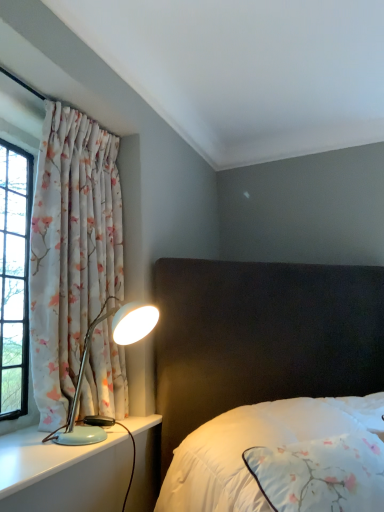
Question: Is white satin bed at center taller or shorter than floral fabric curtain at left?

Choices:
 (A) tall
 (B) short

Answer: (B)

Question: Is white satin bed at center in front of or behind floral fabric curtain at left in the image?

Choices:
 (A) front
 (B) behind

Answer: (A)

Question: Estimate the real-world distances between objects in this image. Which object is closer to the white satin bed at center?

Choices:
 (A) light blue plastic lamp at left
 (B) light blue plastic lamp at left
 (C) floral fabric curtain at left

Answer: (A)

Question: Which of these objects is positioned closest to the floral fabric curtain at left?

Choices:
 (A) light blue plastic lamp at left
 (B) white satin bed at center
 (C) light blue plastic lamp at left

Answer: (C)